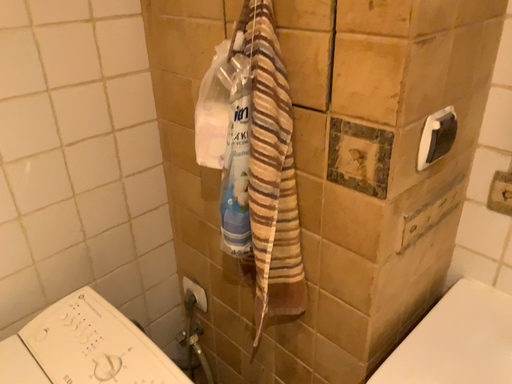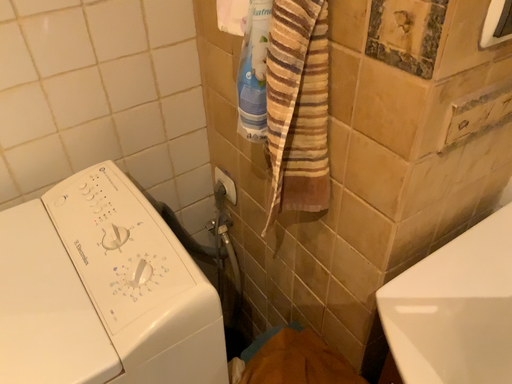
Question: Which way did the camera rotate in the video?

Choices:
 (A) rotated left
 (B) rotated right

Answer: (A)